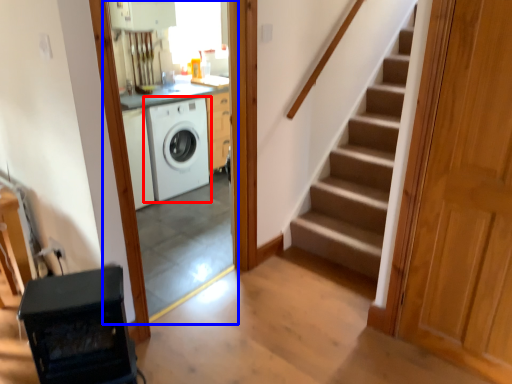
Question: Which point is closer to the camera, washing machine (highlighted by a red box) or screen door (highlighted by a blue box)?

Choices:
 (A) washing machine
 (B) screen door

Answer: (B)